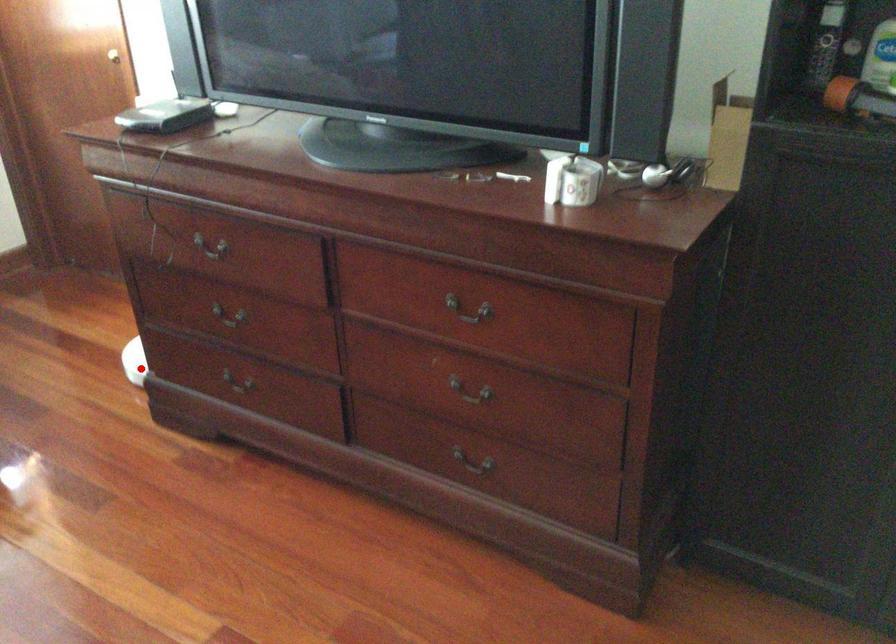
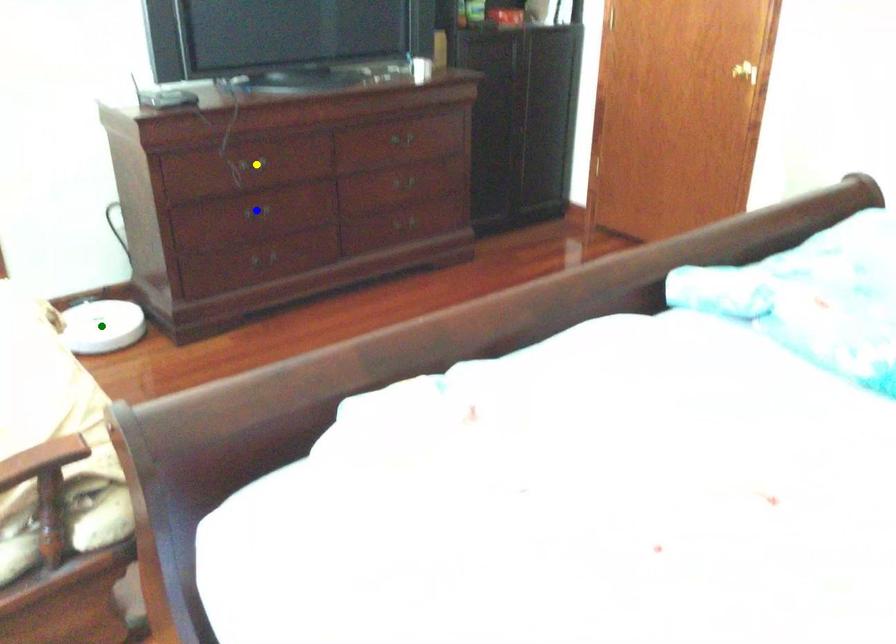
Question: I am providing you with two images of the same scene from different viewpoints. A red point is marked on the first image. You are given multiple points on the second image. Which point in image 2 is actually the same real-world point as the red point in image 1?

Choices:
 (A) blue point
 (B) yellow point
 (C) green point

Answer: (C)